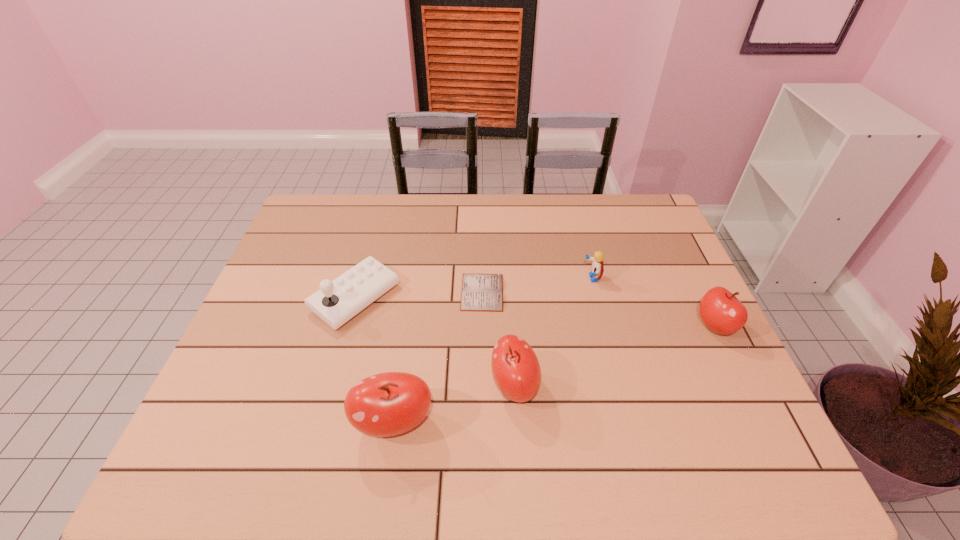
The image size is (960, 540). Identify the location of blank space at the near edge. (346, 418).

In the image, there is a desktop. Identify the location of vacant area at the left edge. The image size is (960, 540). (294, 350).

Locate an element on the screen. The width and height of the screenshot is (960, 540). vacant region at the right edge of the desktop is located at coordinates (684, 266).

Identify the location of vacant region at the far left corner of the desktop. (301, 223).

You are a GUI agent. You are given a task and a screenshot of the screen. Output one action in this format:
    pyautogui.click(x=<x>, y=<y>)
    Task: Click on the vacant space at the near left corner of the desktop
    The width and height of the screenshot is (960, 540).
    Given the screenshot: What is the action you would take?
    pyautogui.click(x=236, y=395)

The image size is (960, 540). What are the coordinates of `free space at the far right corner of the desktop` in the screenshot? It's located at (620, 227).

Identify the location of vacant space that is in between the leftmost apple and the shortest object. (438, 357).

Find the location of a particular element. This screenshot has height=540, width=960. empty space between the second apple from left to right and the second shortest object is located at coordinates (553, 332).

The height and width of the screenshot is (540, 960). In order to click on free space between the second object from right to left and the second tallest object in this screenshot , I will do [553, 332].

Image resolution: width=960 pixels, height=540 pixels. Find the location of `free spot between the joystick and the rightmost object`. free spot between the joystick and the rightmost object is located at coordinates (535, 312).